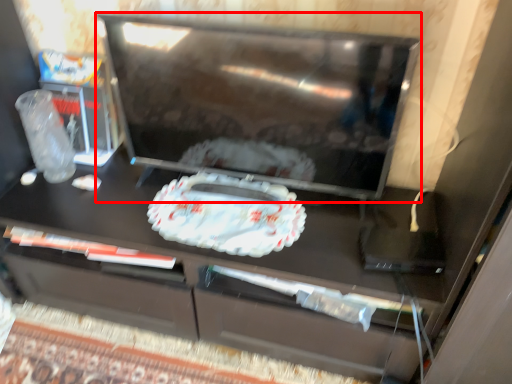
Question: From the image's perspective, where is appliance (annotated by the red box) located relative to food?

Choices:
 (A) above
 (B) below

Answer: (A)